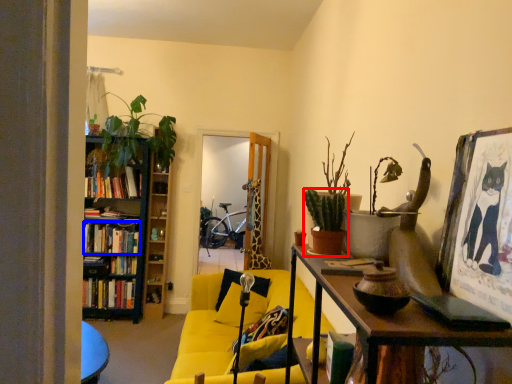
Question: Which object appears closest to the camera in this image, houseplant (highlighted by a red box) or book (highlighted by a blue box)?

Choices:
 (A) houseplant
 (B) book

Answer: (A)